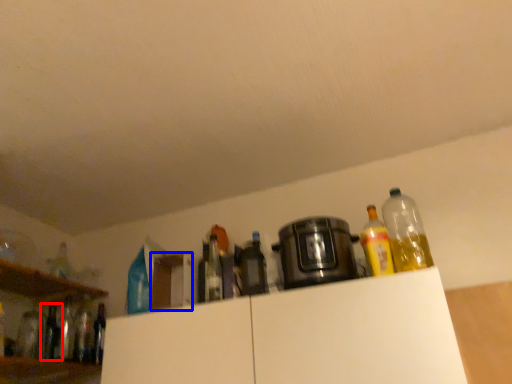
Question: Which object is further to the camera taking this photo, bottle (highlighted by a red box) or cabinetry (highlighted by a blue box)?

Choices:
 (A) bottle
 (B) cabinetry

Answer: (A)